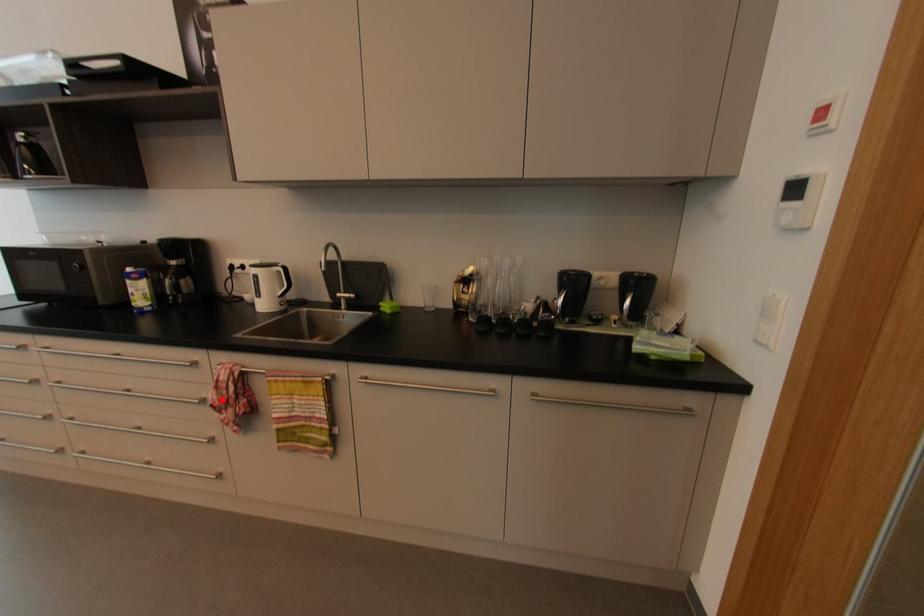
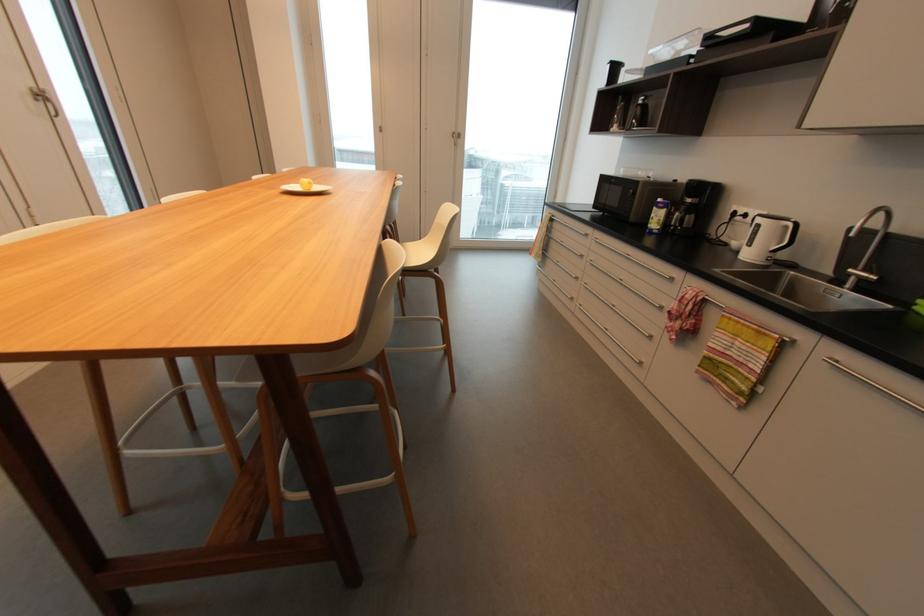
Question: I am providing you with two images of the same scene from different viewpoints. Image1 has a red point marked. In image2, the corresponding 3D location appears at what relative position? Reply with the corresponding letter.

Choices:
 (A) Closer
 (B) Farther

Answer: (A)